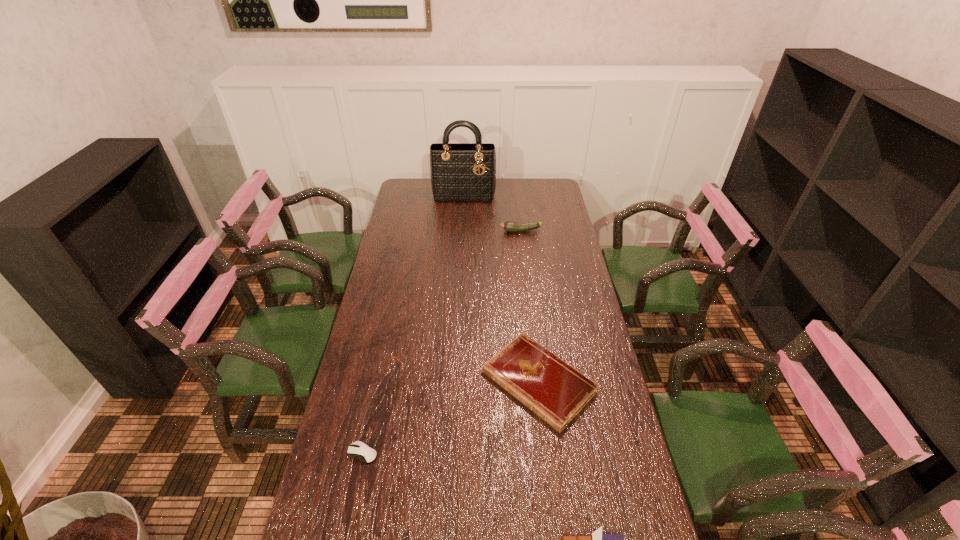
The width and height of the screenshot is (960, 540). I want to click on free space located at the blossom end of the fourth shortest object, so click(436, 231).

Locate an element on the screen. free location located on the back of the notebook is located at coordinates (525, 275).

Identify the location of free space located 0.190m on the back of the mouse. The image size is (960, 540). (376, 387).

Where is `object situated at the far edge`? The width and height of the screenshot is (960, 540). object situated at the far edge is located at coordinates (466, 171).

Locate an element on the screen. The height and width of the screenshot is (540, 960). object that is at the left edge is located at coordinates (358, 449).

At what (x,y) coordinates should I click in order to perform the action: click on zucchini present at the right edge. Please return your answer as a coordinate pair (x, y). The height and width of the screenshot is (540, 960). Looking at the image, I should click on (511, 226).

Locate an element on the screen. The height and width of the screenshot is (540, 960). notebook at the right edge is located at coordinates (555, 391).

At what (x,y) coordinates should I click in order to perform the action: click on free space at the left edge. Please return your answer as a coordinate pair (x, y). The height and width of the screenshot is (540, 960). Looking at the image, I should click on (402, 202).

Image resolution: width=960 pixels, height=540 pixels. I want to click on blank space at the right edge, so click(618, 482).

Where is `free space at the far left corner of the desktop`? free space at the far left corner of the desktop is located at coordinates (404, 188).